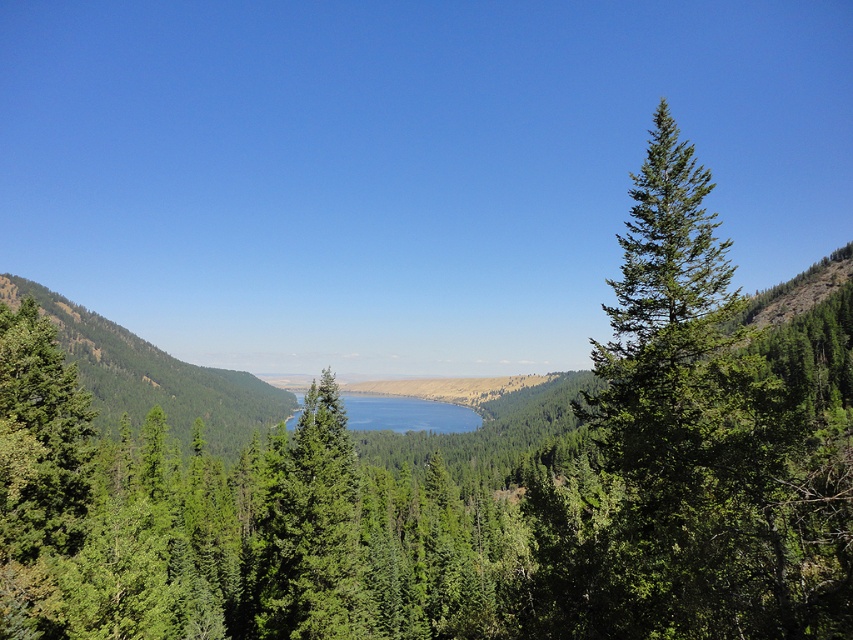
The height and width of the screenshot is (640, 853). What do you see at coordinates (154, 378) in the screenshot?
I see `green forested mountain at center` at bounding box center [154, 378].

Is green forested mountain at center smaller than blue reflective water at center?

Actually, green forested mountain at center might be larger than blue reflective water at center.

Who is more forward, (x=288, y=403) or (x=450, y=429)?

Positioned in front is point (x=450, y=429).

Find the location of `green forested mountain at center`. green forested mountain at center is located at coordinates (154, 378).